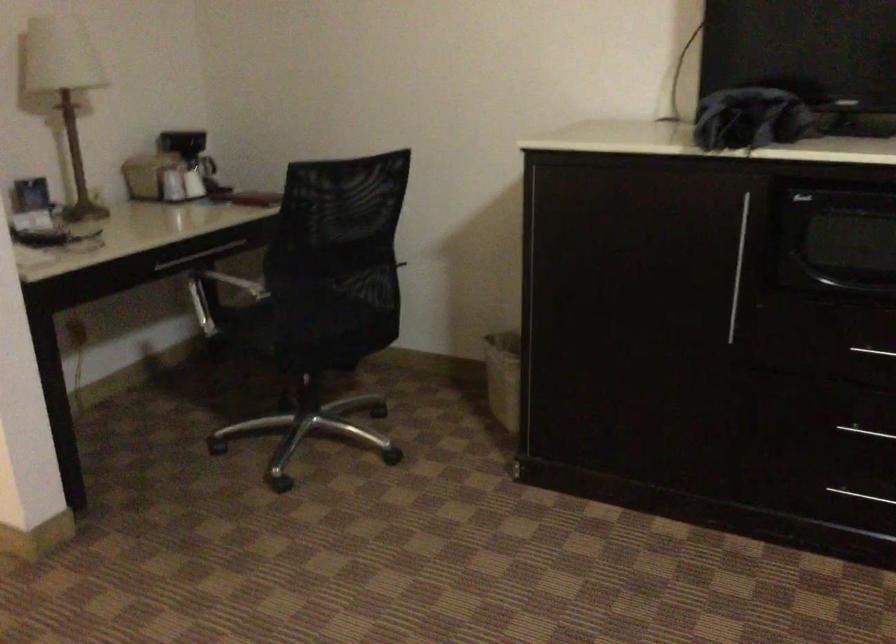
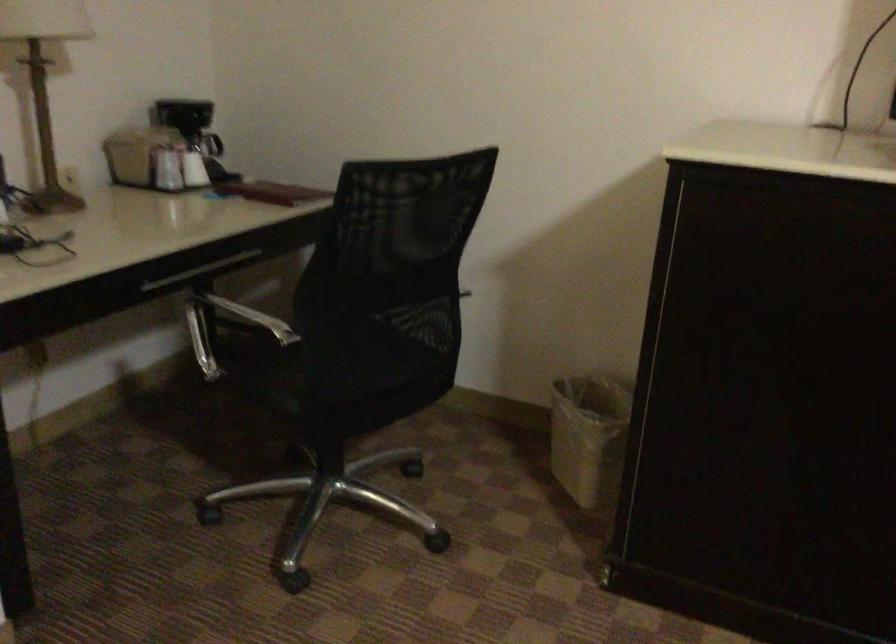
Where in the second image is the point corresponding to the point at 192,182 from the first image?

(194, 169)